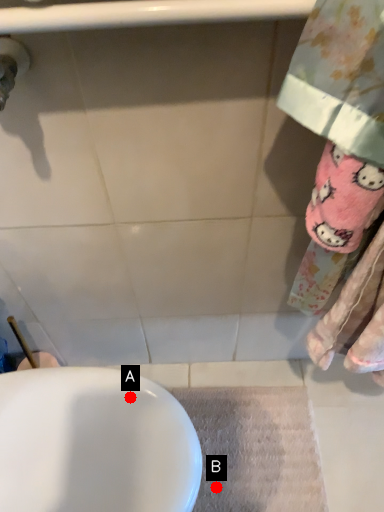
Question: Two points are circled on the image, labeled by A and B beside each circle. Which point appears farthest from the camera in this image?

Choices:
 (A) A is further
 (B) B is further

Answer: (B)